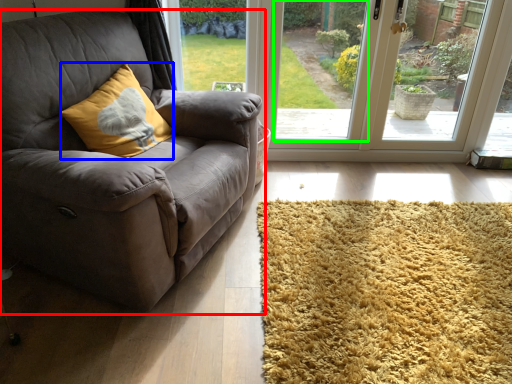
Question: Based on their relative distances, which object is farther from studio couch (highlighted by a red box)? Choose from throw pillow (highlighted by a blue box) and window screen (highlighted by a green box).

Choices:
 (A) throw pillow
 (B) window screen

Answer: (B)